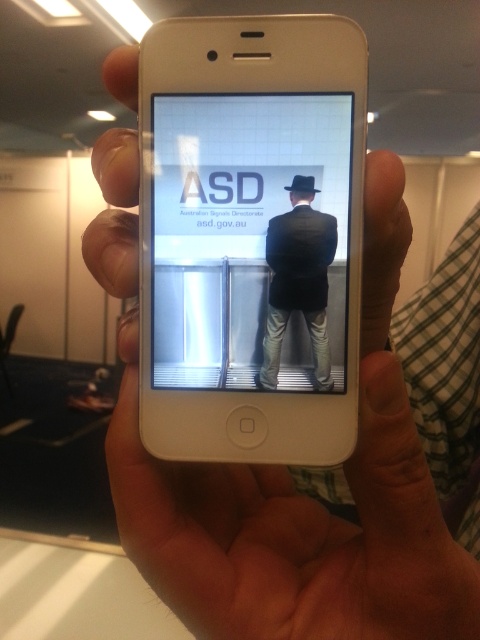
Question: Is white glossy poster at center to the right of dark suit at center from the viewer's perspective?

Choices:
 (A) yes
 (B) no

Answer: (B)

Question: Where is white glossy poster at center located in relation to dark suit at center in the image?

Choices:
 (A) below
 (B) above

Answer: (B)

Question: Which of the following is the farthest from the observer?

Choices:
 (A) white glossy poster at center
 (B) dark suit at center

Answer: (B)

Question: Is white glossy poster at center smaller than dark suit at center?

Choices:
 (A) no
 (B) yes

Answer: (A)

Question: Which object appears closest to the camera in this image?

Choices:
 (A) dark suit at center
 (B) white glossy poster at center

Answer: (B)